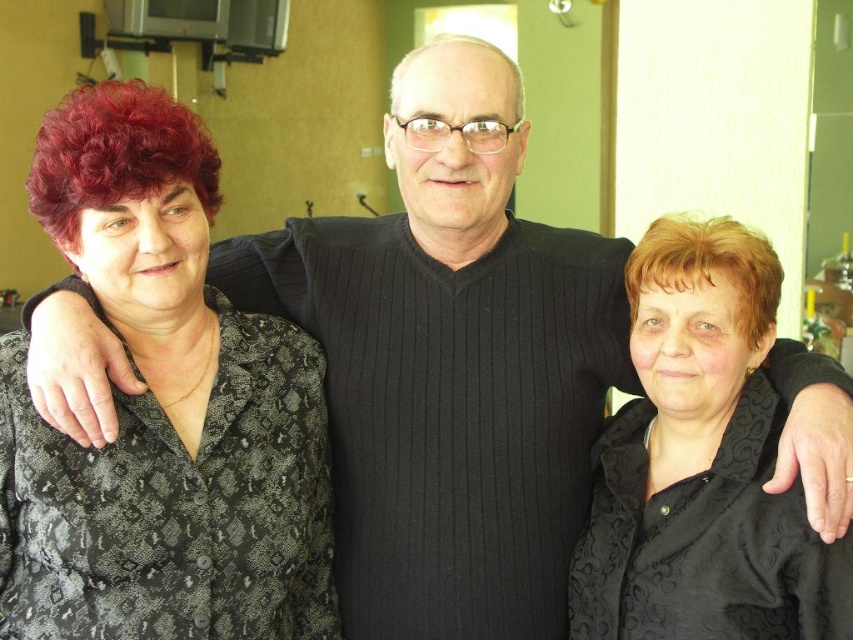
Consider the image. Is black textured blouse at left closer to the viewer compared to black textured blouse at right?

Yes, it is in front of black textured blouse at right.

Who is more forward, (254, 634) or (759, 616)?

Point (759, 616)

This screenshot has width=853, height=640. What are the coordinates of `black textured blouse at left` in the screenshot? It's located at (161, 412).